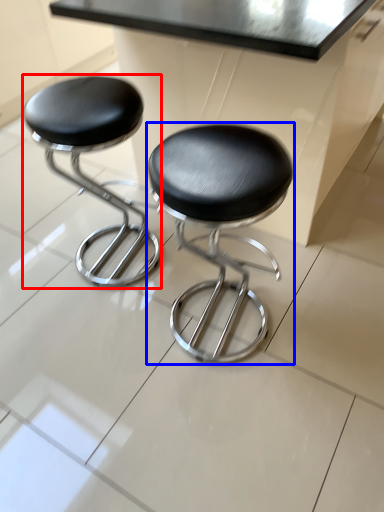
Question: Which point is closer to the camera, stool (highlighted by a red box) or stool (highlighted by a blue box)?

Choices:
 (A) stool
 (B) stool

Answer: (B)